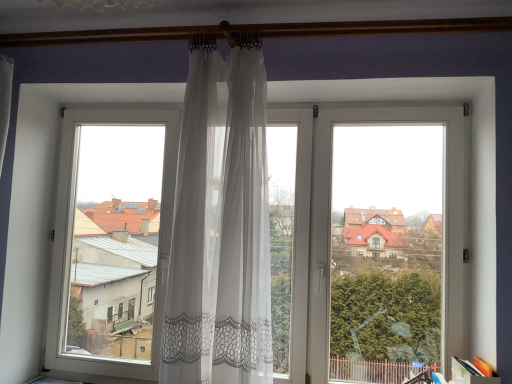
What do you see at coordinates (220, 224) in the screenshot? The height and width of the screenshot is (384, 512). I see `sheer white curtain at center` at bounding box center [220, 224].

Find the location of a particular element. This screenshot has height=384, width=512. sheer white curtain at center is located at coordinates (220, 224).

What do you see at coordinates (367, 221) in the screenshot? I see `transparent lace curtain at center` at bounding box center [367, 221].

Where is `transparent lace curtain at center`? Image resolution: width=512 pixels, height=384 pixels. transparent lace curtain at center is located at coordinates (367, 221).

Identify the location of sheer white curtain at center. This screenshot has height=384, width=512. (220, 224).

Does transparent lace curtain at center appear on the right side of sheer white curtain at center?

Yes, transparent lace curtain at center is to the right of sheer white curtain at center.

Is transparent lace curtain at center positioned before sheer white curtain at center?

No, the depth of transparent lace curtain at center is greater than that of sheer white curtain at center.

Is point (428, 107) closer to camera compared to point (233, 294)?

That is False.

From the image's perspective, between transparent lace curtain at center and sheer white curtain at center, who is located below?

transparent lace curtain at center, from the image's perspective.

From a real-world perspective, is transparent lace curtain at center beneath sheer white curtain at center?

Yes.

Considering the sizes of transparent lace curtain at center and sheer white curtain at center in the image, is transparent lace curtain at center wider or thinner than sheer white curtain at center?

Considering their sizes, transparent lace curtain at center looks slimmer than sheer white curtain at center.

Can you confirm if transparent lace curtain at center is shorter than sheer white curtain at center?

No.

Who is smaller, transparent lace curtain at center or sheer white curtain at center?

Smaller between the two is sheer white curtain at center.

Is transparent lace curtain at center inside or outside of sheer white curtain at center?

transparent lace curtain at center lies outside sheer white curtain at center.

Is transparent lace curtain at center placed right next to sheer white curtain at center?

There is a gap between transparent lace curtain at center and sheer white curtain at center.

Is transparent lace curtain at center oriented towards sheer white curtain at center?

Yes, transparent lace curtain at center is aimed at sheer white curtain at center.

Find the location of a particular element. This screenshot has height=384, width=512. window directly beneath the sheer white curtain at center (from a real-world perspective) is located at coordinates (367, 221).

Does sheer white curtain at center appear on the left side of transparent lace curtain at center?

Correct, you'll find sheer white curtain at center to the left of transparent lace curtain at center.

Is sheer white curtain at center in front of or behind transparent lace curtain at center in the image?

In the image, sheer white curtain at center appears in front of transparent lace curtain at center.

Is point (246, 323) closer or farther from the camera than point (206, 276)?

Point (246, 323) appears to be closer to the viewer than point (206, 276).

From the image's perspective, is sheer white curtain at center under transparent lace curtain at center?

Actually, sheer white curtain at center appears above transparent lace curtain at center in the image.

From a real-world perspective, is sheer white curtain at center positioned over transparent lace curtain at center based on gravity?

Yes.

Which of these two, sheer white curtain at center or transparent lace curtain at center, is wider?

sheer white curtain at center.

Considering the relative sizes of sheer white curtain at center and transparent lace curtain at center in the image provided, is sheer white curtain at center taller than transparent lace curtain at center?

No.

Can you confirm if sheer white curtain at center is smaller than transparent lace curtain at center?

Correct, sheer white curtain at center occupies less space than transparent lace curtain at center.

Is sheer white curtain at center inside the boundaries of transparent lace curtain at center, or outside?

sheer white curtain at center exists outside the volume of transparent lace curtain at center.

Are sheer white curtain at center and transparent lace curtain at center located far from each other?

They are positioned close to each other.

Is sheer white curtain at center facing away from transparent lace curtain at center?

Absolutely, sheer white curtain at center is directed away from transparent lace curtain at center.

How many degrees apart are the facing directions of sheer white curtain at center and transparent lace curtain at center?

There is a 4.37-degree angle between the facing directions of sheer white curtain at center and transparent lace curtain at center.

This screenshot has width=512, height=384. In order to click on curtain on the left of transparent lace curtain at center in this screenshot , I will do `click(220, 224)`.

Where is `window below the sheer white curtain at center (from the image's perspective)`? window below the sheer white curtain at center (from the image's perspective) is located at coordinates (367, 221).

You are a GUI agent. You are given a task and a screenshot of the screen. Output one action in this format:
    pyautogui.click(x=<x>, y=<y>)
    Task: Click on the curtain located in front of the transparent lace curtain at center
    This screenshot has width=512, height=384.
    Given the screenshot: What is the action you would take?
    pyautogui.click(x=220, y=224)